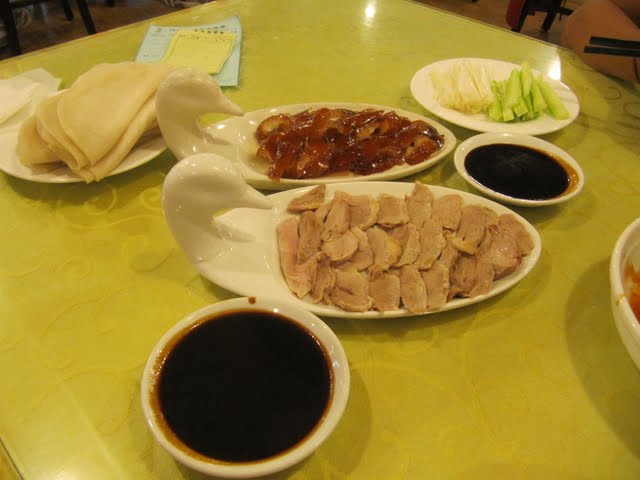
Locate an element on the screen. Image resolution: width=640 pixels, height=480 pixels. white ceramic bird heads is located at coordinates (198, 187), (196, 106).